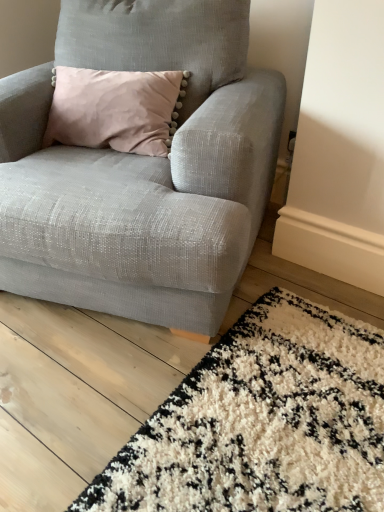
What do you see at coordinates (263, 422) in the screenshot?
I see `white shaggy rug at lower right` at bounding box center [263, 422].

The width and height of the screenshot is (384, 512). I want to click on white shaggy rug at lower right, so click(263, 422).

Describe the element at coordinates (142, 169) in the screenshot. I see `textured gray armchair at center` at that location.

Identify the location of textured gray armchair at center. (142, 169).

Image resolution: width=384 pixels, height=512 pixels. I want to click on white shaggy rug at lower right, so click(263, 422).

Is white shaggy rug at lower right to the right of textured gray armchair at center from the viewer's perspective?

Yes.

Does white shaggy rug at lower right lie behind textured gray armchair at center?

No, it is in front of textured gray armchair at center.

Does point (231, 402) appear closer or farther from the camera than point (179, 212)?

Point (231, 402) appears to be farther away from the viewer than point (179, 212).

From the image's perspective, is white shaggy rug at lower right located beneath textured gray armchair at center?

Yes, from the image's perspective, white shaggy rug at lower right is beneath textured gray armchair at center.

From a real-world perspective, which object rests below the other?

white shaggy rug at lower right.

Considering the sizes of white shaggy rug at lower right and textured gray armchair at center in the image, is white shaggy rug at lower right wider or thinner than textured gray armchair at center?

white shaggy rug at lower right is wider than textured gray armchair at center.

Which of these two, white shaggy rug at lower right or textured gray armchair at center, stands shorter?

With less height is white shaggy rug at lower right.

Is white shaggy rug at lower right smaller than textured gray armchair at center?

Indeed, white shaggy rug at lower right has a smaller size compared to textured gray armchair at center.

Is white shaggy rug at lower right located outside textured gray armchair at center?

Yes, white shaggy rug at lower right is not within textured gray armchair at center.

Are white shaggy rug at lower right and textured gray armchair at center located far from each other?

No.

Is white shaggy rug at lower right aimed at textured gray armchair at center?

No, white shaggy rug at lower right is not aimed at textured gray armchair at center.

How far apart are white shaggy rug at lower right and textured gray armchair at center?

white shaggy rug at lower right is 20.59 inches from textured gray armchair at center.

The image size is (384, 512). In order to click on mat that appears on the right of textured gray armchair at center in this screenshot , I will do `click(263, 422)`.

Based on their positions, is textured gray armchair at center located to the left or right of white shaggy rug at lower right?

In the image, textured gray armchair at center appears on the left side of white shaggy rug at lower right.

Considering their positions, is textured gray armchair at center located in front of or behind white shaggy rug at lower right?

textured gray armchair at center is positioned farther from the viewer than white shaggy rug at lower right.

Is point (76, 5) more distant than point (112, 474)?

That is True.

From the image's perspective, is textured gray armchair at center over white shaggy rug at lower right?

Yes, from the image's perspective, textured gray armchair at center is above white shaggy rug at lower right.

From a real-world perspective, is textured gray armchair at center positioned over white shaggy rug at lower right based on gravity?

Yes, from a real-world perspective, textured gray armchair at center is on top of white shaggy rug at lower right.

In the scene shown: Looking at their sizes, would you say textured gray armchair at center is wider or thinner than white shaggy rug at lower right?

textured gray armchair at center is thinner than white shaggy rug at lower right.

Is textured gray armchair at center taller than white shaggy rug at lower right?

Correct, textured gray armchair at center is much taller as white shaggy rug at lower right.

In the scene shown: Who is smaller, textured gray armchair at center or white shaggy rug at lower right?

white shaggy rug at lower right.

Which is correct: textured gray armchair at center is inside white shaggy rug at lower right, or outside of it?

textured gray armchair at center is spatially situated outside white shaggy rug at lower right.

Would you say textured gray armchair at center is a long distance from white shaggy rug at lower right?

textured gray armchair at center is actually quite close to white shaggy rug at lower right.

Is textured gray armchair at center facing away from white shaggy rug at lower right?

textured gray armchair at center does not have its back to white shaggy rug at lower right.

Based on the photo, how many degrees apart are the facing directions of textured gray armchair at center and white shaggy rug at lower right?

19 degrees separate the facing orientations of textured gray armchair at center and white shaggy rug at lower right.

Measure the distance between textured gray armchair at center and white shaggy rug at lower right.

textured gray armchair at center and white shaggy rug at lower right are 20.59 inches apart.

This screenshot has width=384, height=512. I want to click on chair lying above the white shaggy rug at lower right (from the image's perspective), so click(142, 169).

At what (x,y) coordinates should I click in order to perform the action: click on mat that is below the textured gray armchair at center (from the image's perspective). Please return your answer as a coordinate pair (x, y). This screenshot has height=512, width=384. Looking at the image, I should click on (263, 422).

Identify the location of chair above the white shaggy rug at lower right (from a real-world perspective). The height and width of the screenshot is (512, 384). (142, 169).